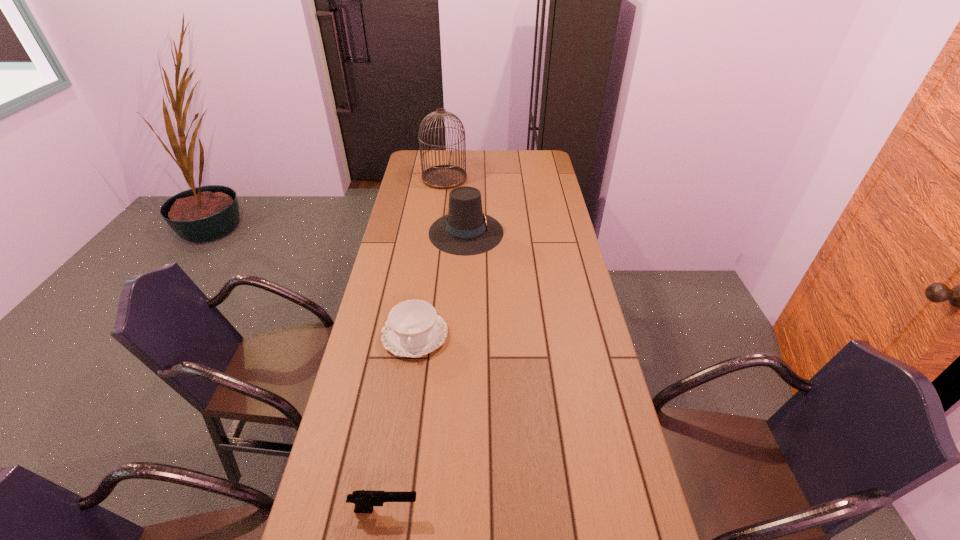
This screenshot has width=960, height=540. I want to click on birdcage, so click(x=444, y=176).

Find the location of a particular element. The image size is (960, 540). the farthest object is located at coordinates (444, 176).

Locate an element on the screen. Image resolution: width=960 pixels, height=540 pixels. the second farthest object is located at coordinates (466, 230).

Where is `the third shortest object`? Image resolution: width=960 pixels, height=540 pixels. the third shortest object is located at coordinates (466, 230).

Locate an element on the screen. pistol is located at coordinates (364, 500).

Locate an element on the screen. This screenshot has height=540, width=960. the third farthest object is located at coordinates (413, 329).

At what (x,y) coordinates should I click in order to perform the action: click on free location located on the back of the tallest object. Please return your answer as a coordinate pair (x, y). Looking at the image, I should click on (446, 163).

Image resolution: width=960 pixels, height=540 pixels. I want to click on free space located on the front-facing side of the hat, so click(559, 232).

Identify the location of blank area located on the front-facing side of the nearest object. The height and width of the screenshot is (540, 960). (458, 510).

Find the location of a particular element. vacant position located 0.180m on the handle side of the second nearest object is located at coordinates (403, 414).